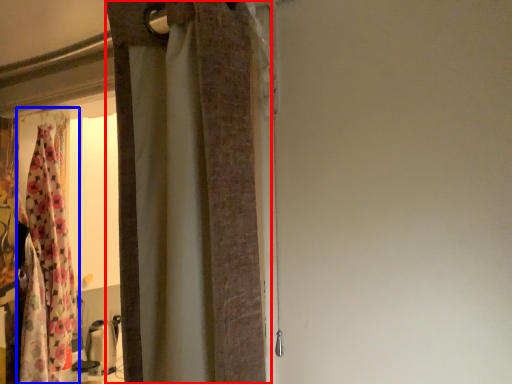
Question: Which point is closer to the camera, curtain (highlighted by a red box) or curtain (highlighted by a blue box)?

Choices:
 (A) curtain
 (B) curtain

Answer: (A)